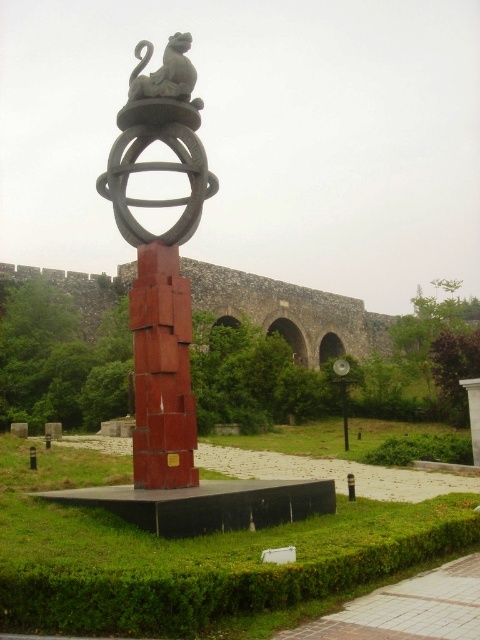
Question: Does red painted metal sculpture at center have a larger size compared to matte red stone sculpture at center?

Choices:
 (A) yes
 (B) no

Answer: (A)

Question: Among these objects, which one is nearest to the camera?

Choices:
 (A) matte red stone sculpture at center
 (B) matte gray stone statue at upper center
 (C) red painted metal sculpture at center

Answer: (C)

Question: Is red painted metal sculpture at center smaller than matte gray stone statue at upper center?

Choices:
 (A) yes
 (B) no

Answer: (B)

Question: Is the position of red painted metal sculpture at center more distant than that of matte gray stone statue at upper center?

Choices:
 (A) no
 (B) yes

Answer: (A)

Question: Estimate the real-world distances between objects in this image. Which object is farther from the matte red stone sculpture at center?

Choices:
 (A) matte gray stone statue at upper center
 (B) red painted metal sculpture at center

Answer: (B)

Question: Which of the following is the farthest from the observer?

Choices:
 (A) red painted metal sculpture at center
 (B) matte red stone sculpture at center

Answer: (B)